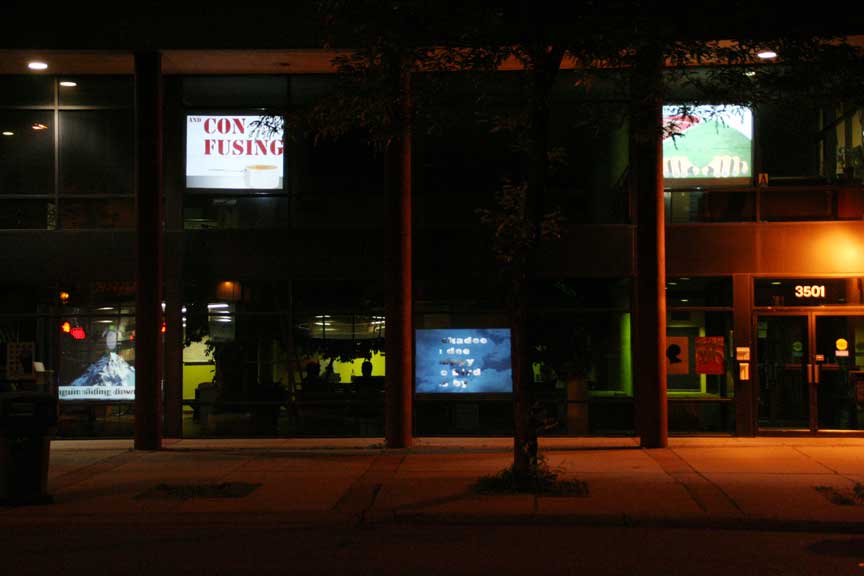
Locate an element on the screen. Image resolution: width=864 pixels, height=576 pixels. lights is located at coordinates (39, 65), (70, 86).